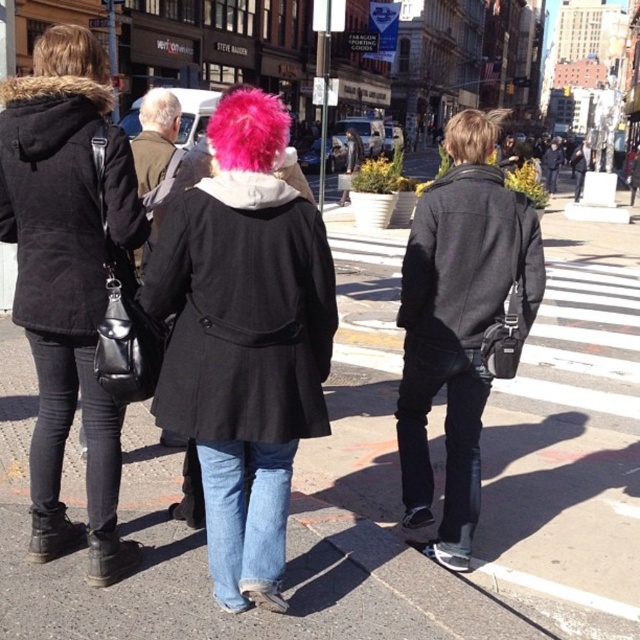
You are a photographer trying to capture the scene. You want to ensure both the blonde hair at center and the gray matte hair at upper left are clearly visible in your photo. Given their sizes, which one might require more careful focus to avoid blurring?

The gray matte hair at upper left might require more careful focus because it is smaller in size compared to the blonde hair at center, making it easier to blur if not properly focused.

You are a photographer trying to capture a candid shot of the person with the blonde hair at center without including the matte black coat at center in the frame. Given their sizes, is this possible?

The matte black coat at center is smaller than blonde hair at center, so it might be challenging to exclude the matte black coat at center from the frame since it is smaller and possibly closer to the camera. Adjust your angle carefully to focus solely on the blonde hair at center.